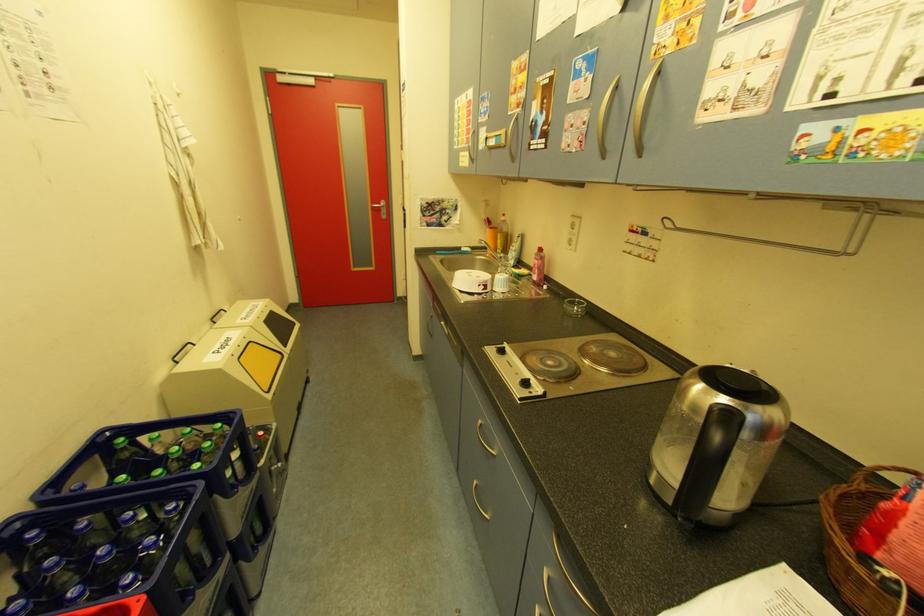
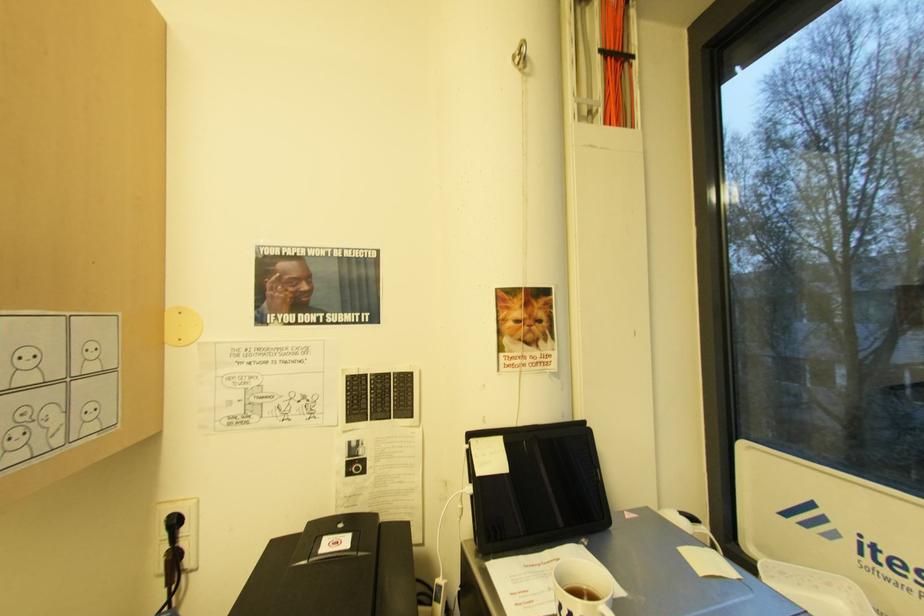
Question: The images are taken continuously from a first-person perspective. In which direction is your viewpoint rotating?

Choices:
 (A) Left
 (B) Right
 (C) Up
 (D) Down

Answer: (B)